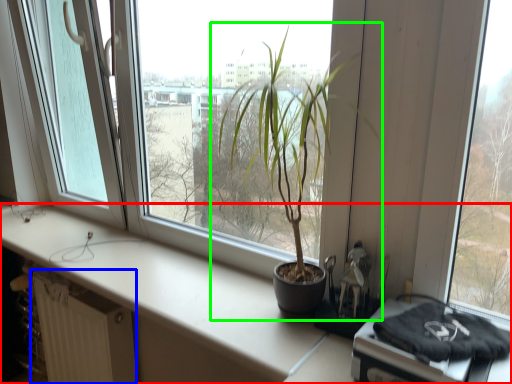
Question: Estimate the real-world distances between objects in this image. Which object is farther from counter top (highlighted by a red box), radiator (highlighted by a blue box) or houseplant (highlighted by a green box)?

Choices:
 (A) radiator
 (B) houseplant

Answer: (B)